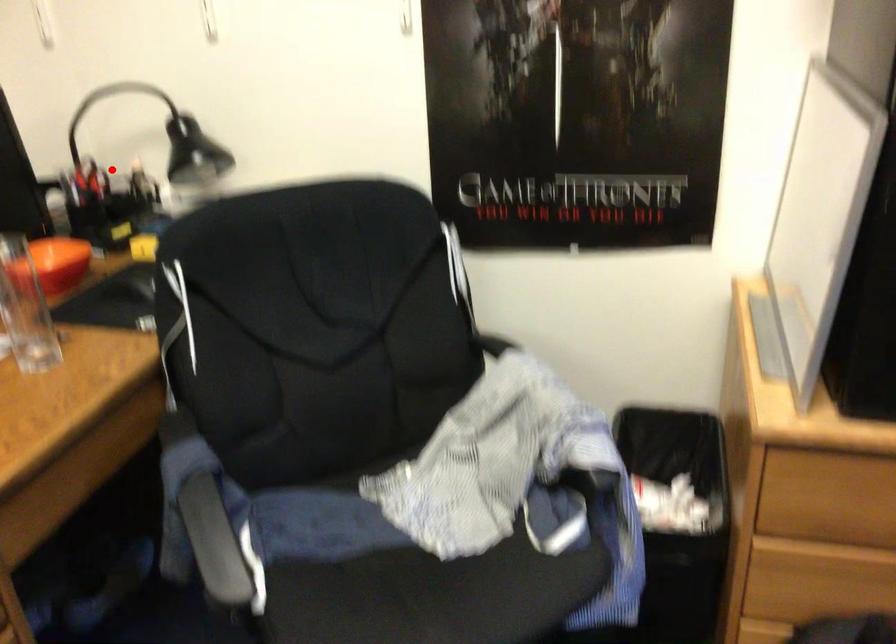
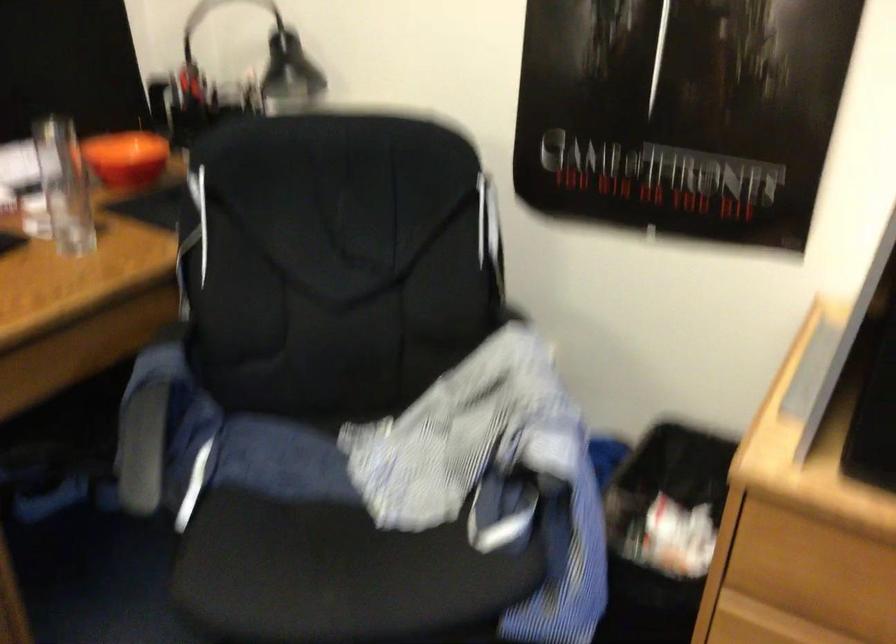
In the second image, find the point that corresponds to the highlighted location in the first image.

(233, 82)